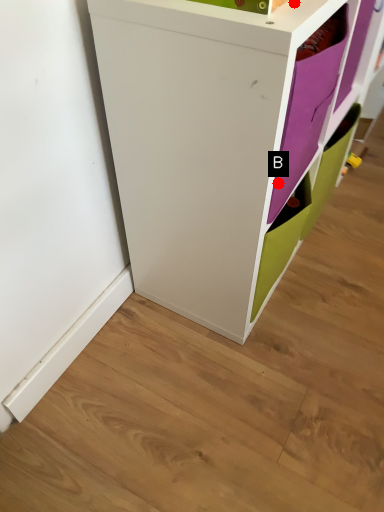
Question: Two points are circled on the image, labeled by A and B beside each circle. Among these points, which one is nearest to the camera?

Choices:
 (A) A is closer
 (B) B is closer

Answer: (A)